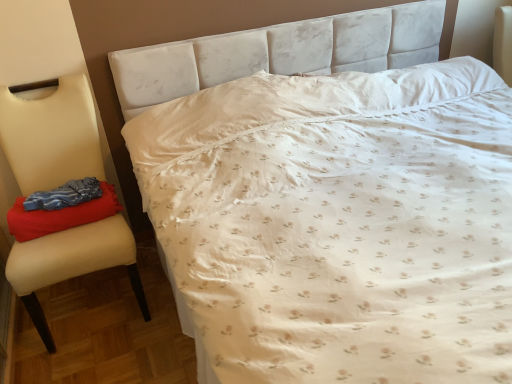
The image size is (512, 384). What do you see at coordinates (60, 215) in the screenshot?
I see `velvety red blanket at left` at bounding box center [60, 215].

This screenshot has height=384, width=512. What are the coordinates of `velvety red blanket at left` in the screenshot? It's located at (60, 215).

What do you see at coordinates (51, 136) in the screenshot?
I see `beige leather chair at left` at bounding box center [51, 136].

The width and height of the screenshot is (512, 384). Identify the location of beige leather chair at left. (51, 136).

Measure the distance between point [71,139] and camera.

The distance of point [71,139] from camera is 6.05 feet.

Identify the location of velvety red blanket at left. (60, 215).

Considering the relative positions of velvety red blanket at left and beige leather chair at left in the image provided, is velvety red blanket at left to the right of beige leather chair at left from the viewer's perspective?

Yes, velvety red blanket at left is to the right of beige leather chair at left.

Is the position of velvety red blanket at left less distant than that of beige leather chair at left?

That is False.

Is point (26, 219) positioned before point (51, 104)?

That is True.

From the image's perspective, which one is positioned lower, velvety red blanket at left or beige leather chair at left?

beige leather chair at left.

From a real-world perspective, is velvety red blanket at left beneath beige leather chair at left?

No, from a real-world perspective, velvety red blanket at left is not below beige leather chair at left.

Considering the relative sizes of velvety red blanket at left and beige leather chair at left in the image provided, is velvety red blanket at left wider than beige leather chair at left?

No, velvety red blanket at left is not wider than beige leather chair at left.

From their relative heights in the image, would you say velvety red blanket at left is taller or shorter than beige leather chair at left?

velvety red blanket at left is shorter than beige leather chair at left.

Does velvety red blanket at left have a smaller size compared to beige leather chair at left?

Correct, velvety red blanket at left occupies less space than beige leather chair at left.

Can beige leather chair at left be found inside velvety red blanket at left?

No, beige leather chair at left is located outside of velvety red blanket at left.

Is velvety red blanket at left with beige leather chair at left?

No.

Is velvety red blanket at left oriented away from beige leather chair at left?

Yes, velvety red blanket at left is positioned with its back facing beige leather chair at left.

Can you tell me how much velvety red blanket at left and beige leather chair at left differ in facing direction?

0.449 degrees.

You are a GUI agent. You are given a task and a screenshot of the screen. Output one action in this format:
    pyautogui.click(x=<x>, y=<y>)
    Task: Click on the chair located on the left of velvety red blanket at left
    The width and height of the screenshot is (512, 384).
    Given the screenshot: What is the action you would take?
    pyautogui.click(x=51, y=136)

Considering the positions of objects beige leather chair at left and velvety red blanket at left in the image provided, who is more to the right, beige leather chair at left or velvety red blanket at left?

Positioned to the right is velvety red blanket at left.

Is the depth of beige leather chair at left less than that of velvety red blanket at left?

That is True.

Which point is more forward, [44,158] or [86,205]?

Point [86,205]

From the image's perspective, which is below, beige leather chair at left or velvety red blanket at left?

beige leather chair at left, from the image's perspective.

From a real-world perspective, between beige leather chair at left and velvety red blanket at left, who is vertically lower?

beige leather chair at left, from a real-world perspective.

Between beige leather chair at left and velvety red blanket at left, which one has larger width?

beige leather chair at left is wider.

Is beige leather chair at left taller or shorter than velvety red blanket at left?

Considering their sizes, beige leather chair at left has more height than velvety red blanket at left.

Considering the sizes of beige leather chair at left and velvety red blanket at left in the image, is beige leather chair at left bigger or smaller than velvety red blanket at left?

In the image, beige leather chair at left appears to be larger than velvety red blanket at left.

Would you say beige leather chair at left is outside velvety red blanket at left?

beige leather chair at left is positioned outside velvety red blanket at left.

From the picture: Can you see beige leather chair at left touching velvety red blanket at left?

beige leather chair at left and velvety red blanket at left are clearly separated.

Is beige leather chair at left oriented towards velvety red blanket at left?

Yes, beige leather chair at left is oriented towards velvety red blanket at left.

At what (x,y) coordinates should I click in order to perform the action: click on material that appears on the right of beige leather chair at left. Please return your answer as a coordinate pair (x, y). Image resolution: width=512 pixels, height=384 pixels. Looking at the image, I should click on (60, 215).

The height and width of the screenshot is (384, 512). In the image, there is a beige leather chair at left. In order to click on material above it (from the image's perspective) in this screenshot , I will do `click(60, 215)`.

Identify the location of material lying on the right of beige leather chair at left. (60, 215).